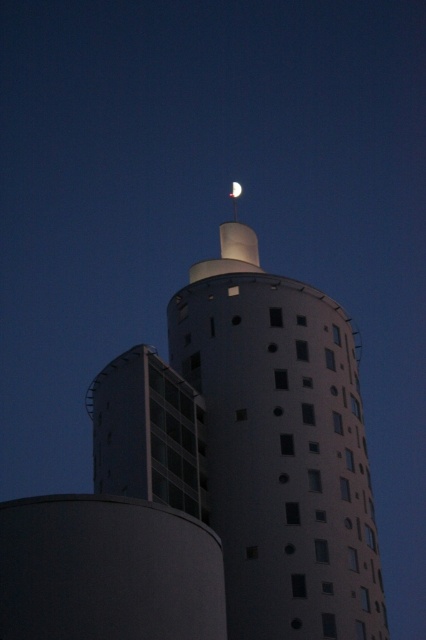
Does white matte tower at upper center appear on the right side of silver metallic moon at upper center?

Indeed, white matte tower at upper center is positioned on the right side of silver metallic moon at upper center.

Consider the image. Can you confirm if white matte tower at upper center is positioned below silver metallic moon at upper center?

Indeed, white matte tower at upper center is positioned under silver metallic moon at upper center.

What do you see at coordinates (281, 448) in the screenshot?
I see `white matte tower at upper center` at bounding box center [281, 448].

Find the location of a particular element. This screenshot has width=426, height=640. white matte tower at upper center is located at coordinates (281, 448).